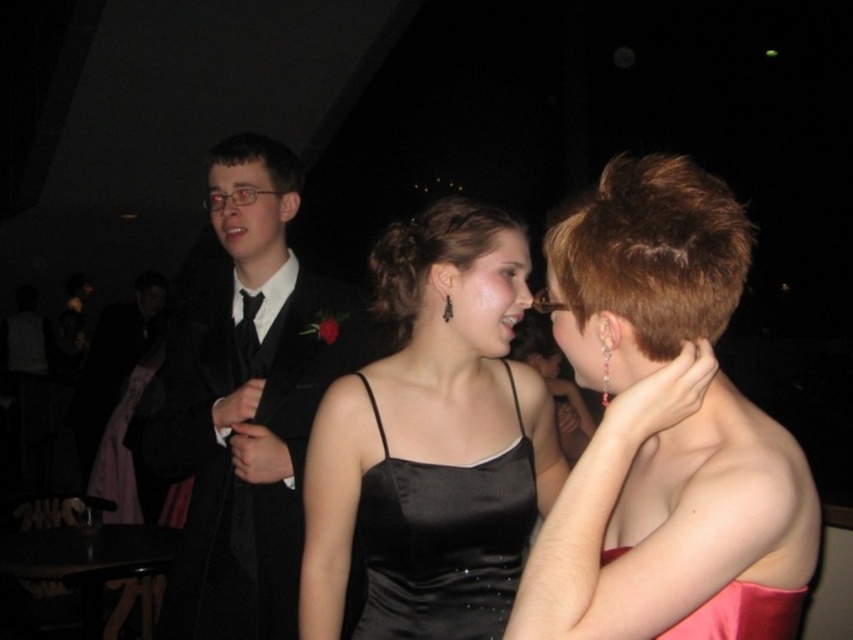
You are a photographer at a formal event. You need to position a spotlight on the black satin suit at left and the black satin tie at center. Since the spotlight can only illuminate one object at a time, which object should you aim it at first if you want to follow the left to right scanning direction?

The black satin suit at left is to the left of the black satin tie at center, so you should aim the spotlight at the black satin suit at left first to follow the left to right scanning direction.

You are a photographer standing at the camera position. You want to take a closeup of the black satin dress at center. Can you step forward to get closer? The minimum focusing distance of your camera is 1.5 meters.

The black satin dress at center and camera are 1.49 meters apart, which is less than the camera minimum focusing distance of 1.5 meters. Therefore, you cannot step forward to get closer.